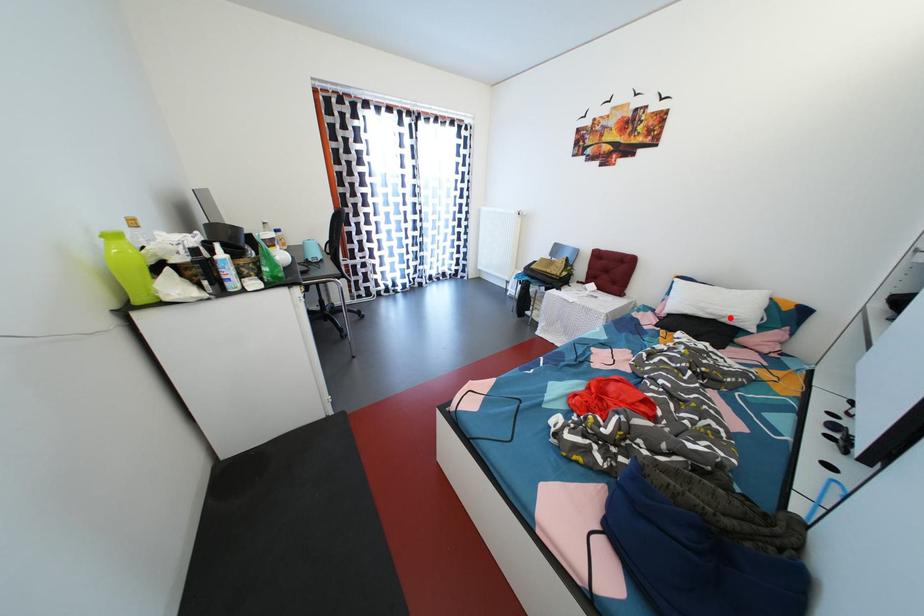
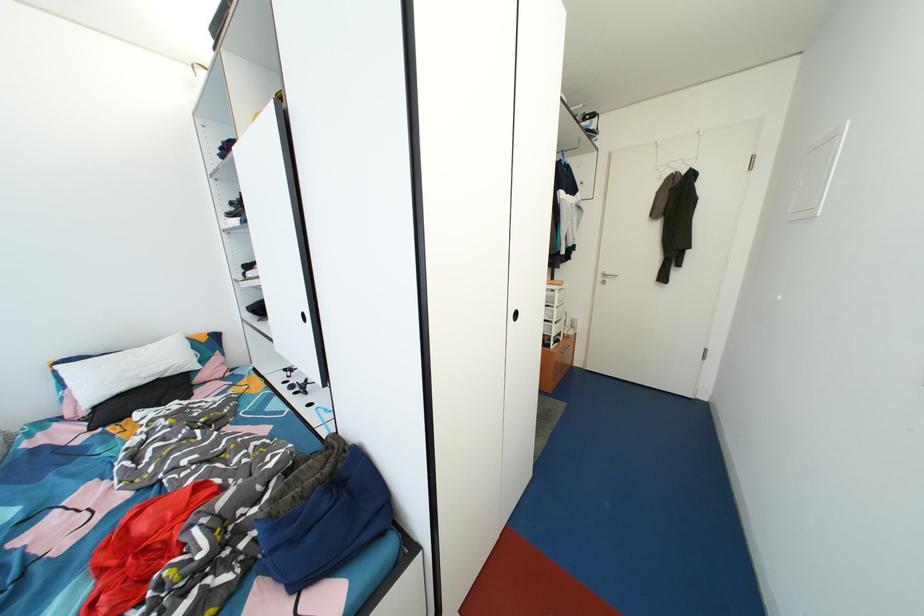
In the second image, find the point that corresponds to the highlighted location in the first image.

(167, 373)